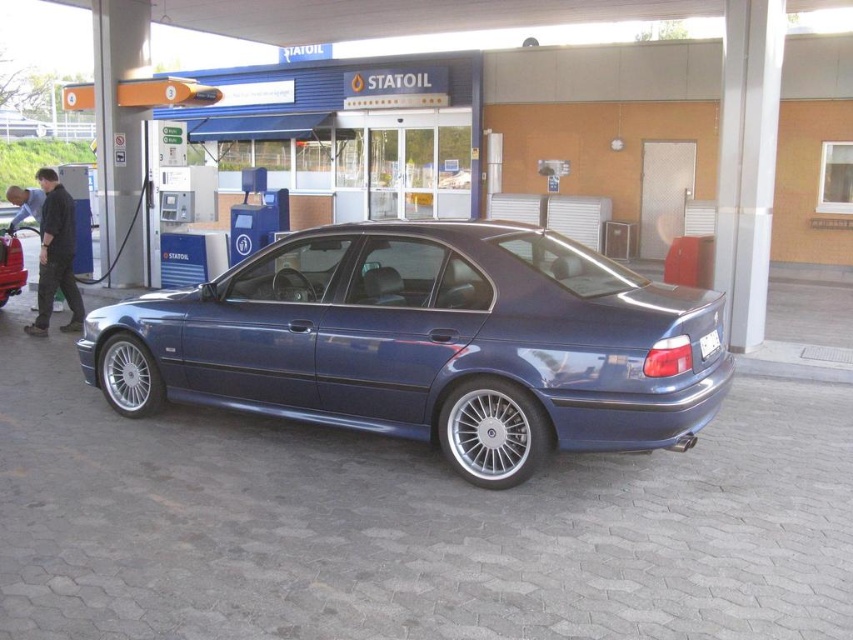
Question: Is metallic blue sedan at center closer to camera compared to matte blue sedan at center?

Choices:
 (A) no
 (B) yes

Answer: (B)

Question: Estimate the real-world distances between objects in this image. Which object is farther from the white plastic license plate at rear?

Choices:
 (A) metallic blue sedan at center
 (B) matte blue sedan at center

Answer: (B)

Question: Does metallic blue sedan at center appear over matte blue sedan at center?

Choices:
 (A) yes
 (B) no

Answer: (B)

Question: Does metallic blue sedan at center appear over white plastic license plate at rear?

Choices:
 (A) no
 (B) yes

Answer: (B)

Question: Which of the following is the closest to the observer?

Choices:
 (A) white plastic license plate at rear
 (B) matte blue sedan at center

Answer: (A)

Question: Which point is closer to the camera taking this photo?

Choices:
 (A) (703, 358)
 (B) (12, 237)

Answer: (A)